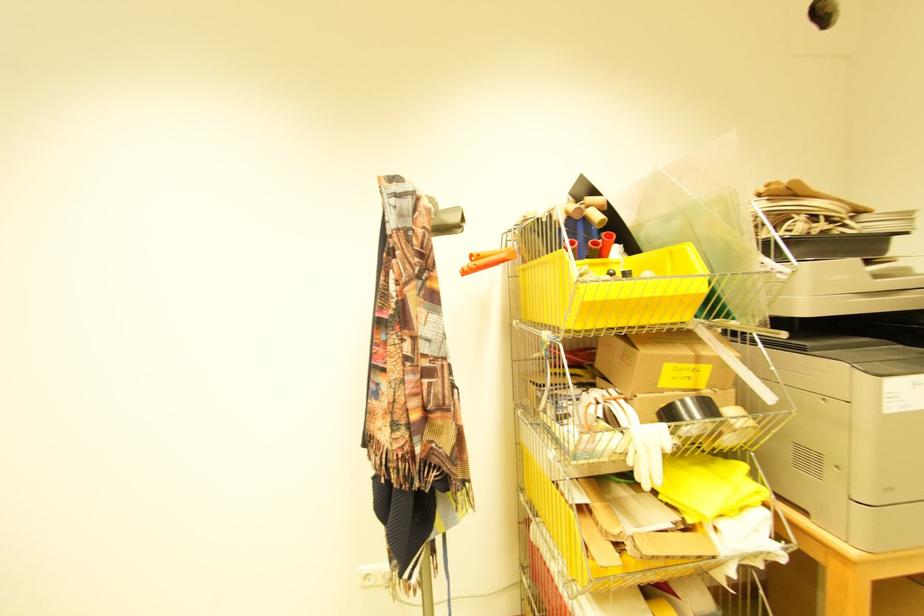
Where would you lift the printer scanner lid? Please return your answer as a coordinate pair (x, y).

(902, 304)